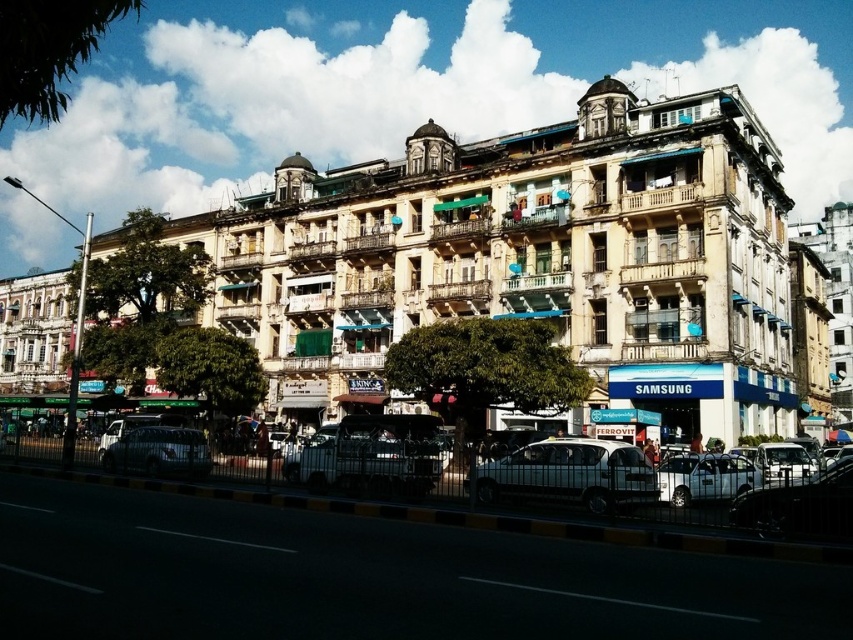
Who is more distant from viewer, (363,445) or (146,438)?

Point (146,438)

Does metallic silver car at center have a greater height compared to metallic silver van at center?

Yes, metallic silver car at center is taller than metallic silver van at center.

The width and height of the screenshot is (853, 640). What do you see at coordinates (370, 454) in the screenshot? I see `metallic silver car at center` at bounding box center [370, 454].

The height and width of the screenshot is (640, 853). In order to click on metallic silver car at center in this screenshot , I will do `click(370, 454)`.

Between point (418, 422) and point (724, 452), which one is positioned in front?

Point (724, 452) is more forward.

Which is below, metallic silver car at center or silver metallic sedan at center?

silver metallic sedan at center

Between point (363, 483) and point (729, 468), which one is positioned behind?

Point (363, 483)

Find the location of a particular element. The image size is (853, 640). metallic silver car at center is located at coordinates 370,454.

Does point (642, 106) come closer to viewer compared to point (744, 486)?

No, it is not.

Is beige stone building at center thinner than silver metallic sedan at center?

No, beige stone building at center is not thinner than silver metallic sedan at center.

Locate an element on the screen. The image size is (853, 640). beige stone building at center is located at coordinates (531, 262).